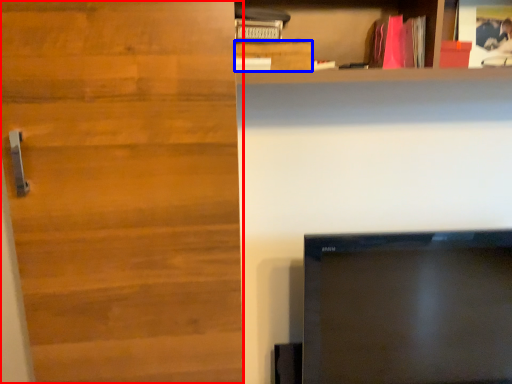
Question: Which object is further to the camera taking this photo, door (highlighted by a red box) or cabinetry (highlighted by a blue box)?

Choices:
 (A) door
 (B) cabinetry

Answer: (B)